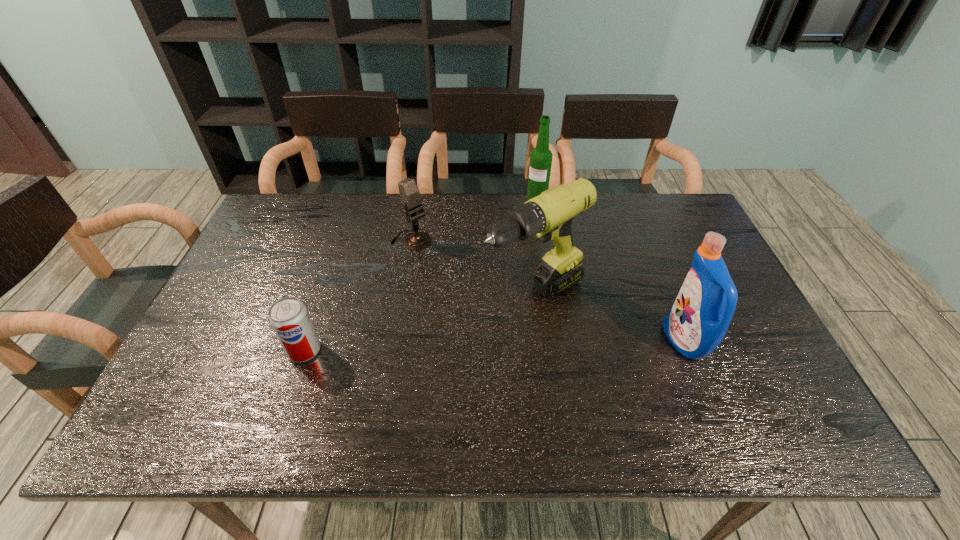
Image resolution: width=960 pixels, height=540 pixels. Find the location of `microphone that is positioned at the far edge`. microphone that is positioned at the far edge is located at coordinates (409, 192).

The height and width of the screenshot is (540, 960). I want to click on beer bottle that is at the far edge, so click(541, 157).

Where is `object present at the near edge`? This screenshot has width=960, height=540. object present at the near edge is located at coordinates click(x=697, y=322).

Locate an element on the screen. The width and height of the screenshot is (960, 540). object at the right edge is located at coordinates (697, 322).

Locate an element on the screen. object that is at the near right corner is located at coordinates (697, 322).

This screenshot has width=960, height=540. Identify the location of vacant position at the far edge of the desktop. (385, 228).

The image size is (960, 540). What are the coordinates of `vacant space at the near edge` in the screenshot? It's located at (497, 367).

This screenshot has width=960, height=540. In the image, there is a desktop. Find the location of `vacant area at the left edge`. vacant area at the left edge is located at coordinates (222, 293).

In order to click on free area in between the fourth nearest object and the drill in this screenshot , I will do `click(473, 267)`.

This screenshot has height=540, width=960. In order to click on vacant region between the rightmost object and the drill in this screenshot , I will do `click(610, 318)`.